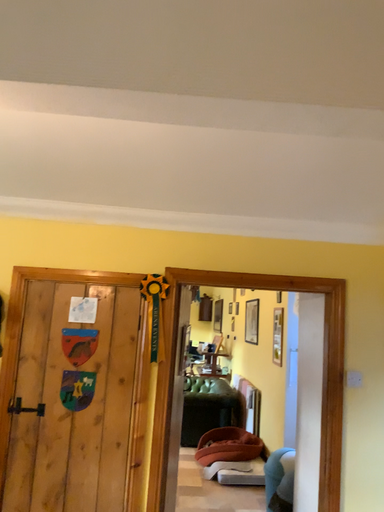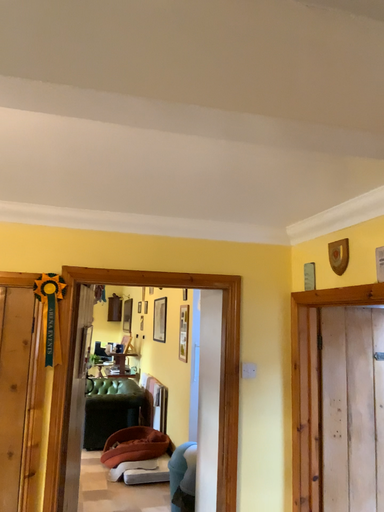
Question: How did the camera likely rotate when shooting the video?

Choices:
 (A) rotated right
 (B) rotated left

Answer: (A)